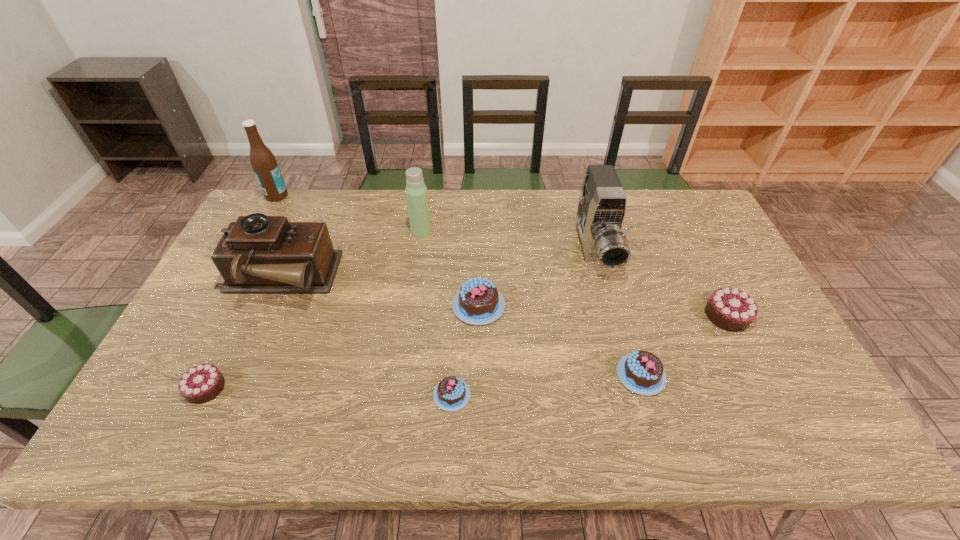
Where is `free area in between the fourth chocolate cake from left to right and the phonograph_record`? The width and height of the screenshot is (960, 540). free area in between the fourth chocolate cake from left to right and the phonograph_record is located at coordinates (459, 327).

Image resolution: width=960 pixels, height=540 pixels. Identify the location of empty space that is in between the phonograph_record and the farthest pink chocolate cake. (377, 293).

The height and width of the screenshot is (540, 960). I want to click on free space between the biggest pink chocolate cake and the smaller chocolate chocolate cake, so [343, 347].

The height and width of the screenshot is (540, 960). Find the location of `vacant area that lies between the phonograph_record and the biggest pink chocolate cake`. vacant area that lies between the phonograph_record and the biggest pink chocolate cake is located at coordinates (377, 293).

This screenshot has width=960, height=540. I want to click on vacant space that is in between the shortest chocolate cake and the sixth shortest object, so click(364, 338).

Identify the location of unoccupied position between the farthest pink chocolate cake and the fourth tallest object. (377, 293).

Where is `vacant region between the bigger chocolate chocolate cake and the farthest pink chocolate cake`? The height and width of the screenshot is (540, 960). vacant region between the bigger chocolate chocolate cake and the farthest pink chocolate cake is located at coordinates (603, 310).

I want to click on object that ranks as the fifth closest to the second smallest pink chocolate cake, so click(x=416, y=191).

Locate an element on the screen. the third closest object to the phonograph_record is located at coordinates (264, 164).

Identify which chocolate cake is the closest to the smaller chocolate chocolate cake. Please provide its 2D coordinates. Your answer should be formatted as a tuple, i.e. [(x, y)], where the tuple contains the x and y coordinates of a point satisfying the conditions above.

[(451, 394)]